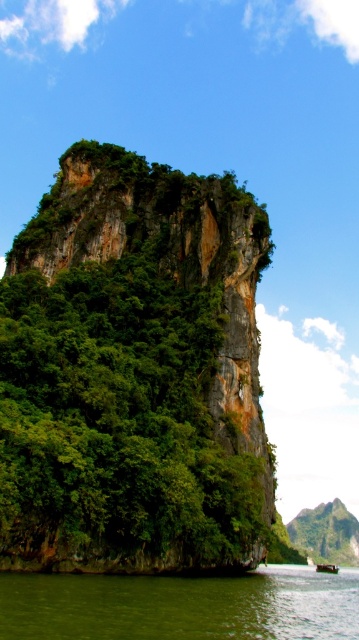
You are a hiker standing on the edge of the green rocky cliff at center. You notice the green liquid water at lower center below you. Based on the scene, can you determine the relationship between the two in terms of their vertical positioning?

The green rocky cliff at center is positioned over the green liquid water at lower center, meaning the cliff is above the water.

You are standing on a platform near the water and see the green rocky cliff at center and the metallic gray boat at center. Which object is positioned to the left from your perspective?

The green rocky cliff at center is positioned to the left of the metallic gray boat at center from your perspective.

You are a drone operator tasked with capturing aerial footage of the green rocky cliff at center. The drone must hover exactly at the coordinates provided in the Objects Description to get the perfect shot. What are the coordinates where the drone should position itself?

The drone should position itself at coordinates point (133, 372) to capture the green rocky cliff at center as specified.